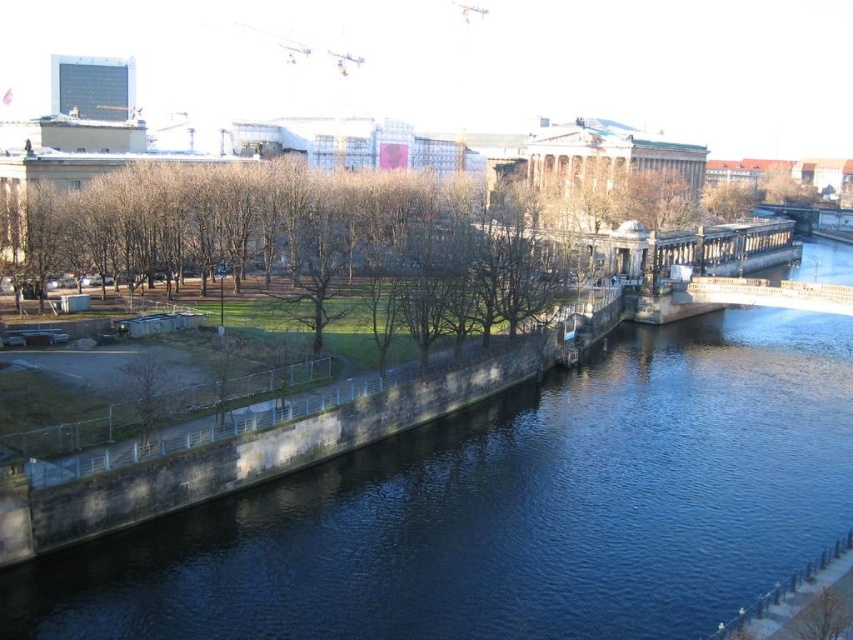
You are a pedestrian wanting to cross the river using the stone bridge at center. However, there is a blue stone river at center in your path. Based on the scene description, can you determine which direction you should walk to reach the bridge without stepping into the river?

The blue stone river at center is to the left of the stone bridge at center, so you should walk to the right to reach the bridge without stepping into the river.